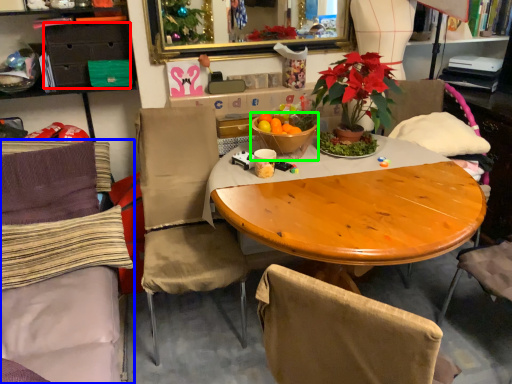
Question: Considering the real-world distances, which object is farthest from drawer (highlighted by a red box)? chair (highlighted by a blue box) or tableware (highlighted by a green box)?

Choices:
 (A) chair
 (B) tableware

Answer: (B)